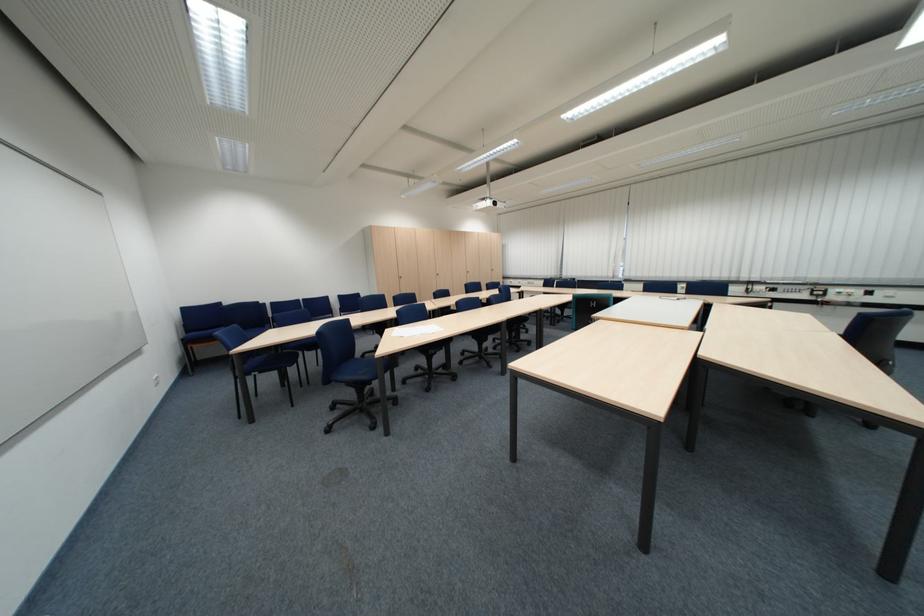
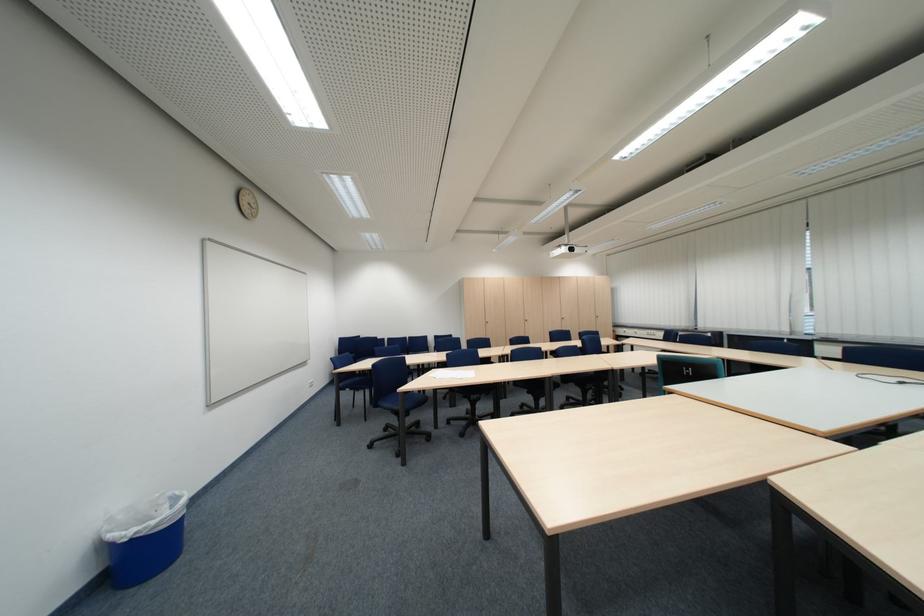
Find the pixel in the second image that matches (x=621, y=307) in the first image.

(726, 378)